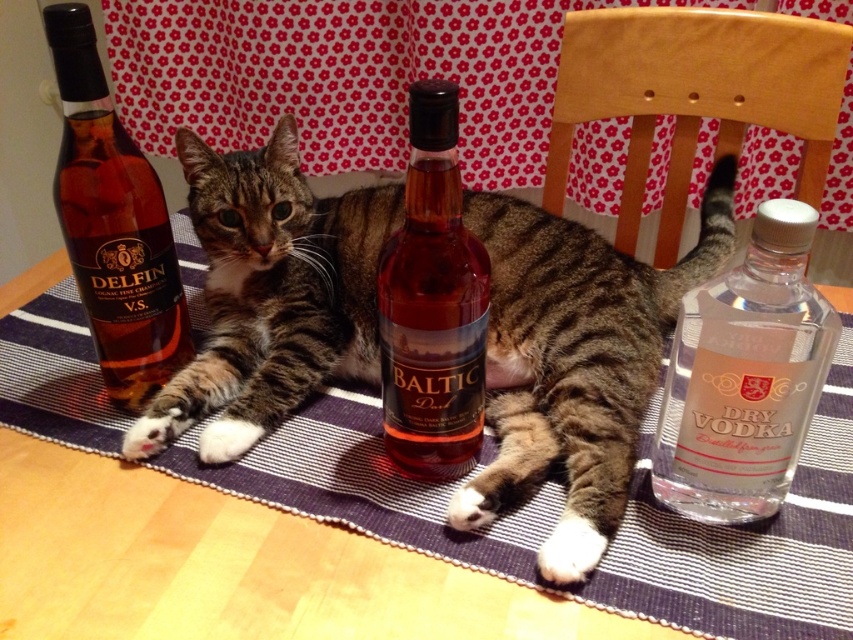
Does point (728, 452) come farther from viewer compared to point (166, 236)?

No, (728, 452) is in front of (166, 236).

Measure the distance between point (x=703, y=342) and camera.

Point (x=703, y=342) and camera are 16.30 inches apart.

Describe the element at coordinates (746, 376) in the screenshot. I see `clear glass bottle at right` at that location.

What are the coordinates of `clear glass bottle at right` in the screenshot? It's located at (746, 376).

Is translucent amber liquid at center to the left of matte glass bottle at left from the viewer's perspective?

In fact, translucent amber liquid at center is to the right of matte glass bottle at left.

Is point (444, 83) closer to viewer compared to point (149, 250)?

That is True.

Image resolution: width=853 pixels, height=640 pixels. Identify the location of translucent amber liquid at center. (432, 304).

Who is positioned more to the right, tabby fur cat at center or clear glass bottle at right?

clear glass bottle at right is more to the right.

Does tabby fur cat at center have a greater width compared to clear glass bottle at right?

Yes.

Describe the element at coordinates (575, 360) in the screenshot. I see `tabby fur cat at center` at that location.

You are a GUI agent. You are given a task and a screenshot of the screen. Output one action in this format:
    pyautogui.click(x=<x>, y=<y>)
    Task: Click on the tabby fur cat at center
    This screenshot has width=853, height=640.
    Given the screenshot: What is the action you would take?
    pyautogui.click(x=575, y=360)